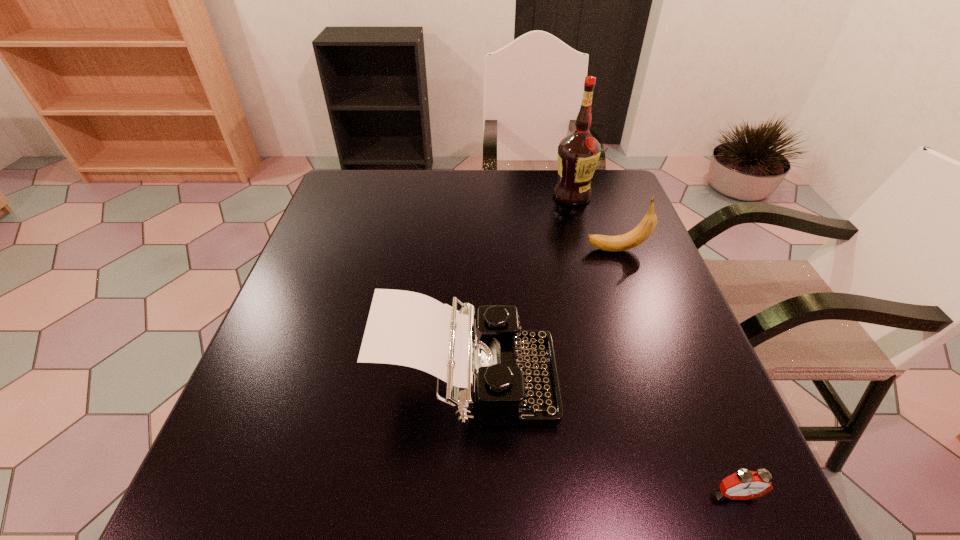
This screenshot has height=540, width=960. I want to click on free area in between the farthest object and the third nearest object, so click(594, 223).

Identify the location of free spot between the second farthest object and the third farthest object. This screenshot has height=540, width=960. (542, 316).

You are a GUI agent. You are given a task and a screenshot of the screen. Output one action in this format:
    pyautogui.click(x=<x>, y=<y>)
    Task: Click on the empty space that is in between the third nearest object and the nearest object
    Image resolution: width=960 pixels, height=540 pixels.
    Given the screenshot: What is the action you would take?
    tap(676, 372)

Locate an element on the screen. Image resolution: width=960 pixels, height=540 pixels. free spot between the nearest object and the leftmost object is located at coordinates (602, 438).

Select which object appears as the third closest to the leftmost object. Please provide its 2D coordinates. Your answer should be formatted as a tuple, i.e. [(x, y)], where the tuple contains the x and y coordinates of a point satisfying the conditions above.

[(578, 153)]

Identify which object is the third closest to the typewriter. Please provide its 2D coordinates. Your answer should be formatted as a tuple, i.e. [(x, y)], where the tuple contains the x and y coordinates of a point satisfying the conditions above.

[(578, 153)]

Locate an element on the screen. The height and width of the screenshot is (540, 960). vacant space that satisfies the following two spatial constraints: 1. on the label of the tallest object; 2. on the keys of the third farthest object is located at coordinates (624, 383).